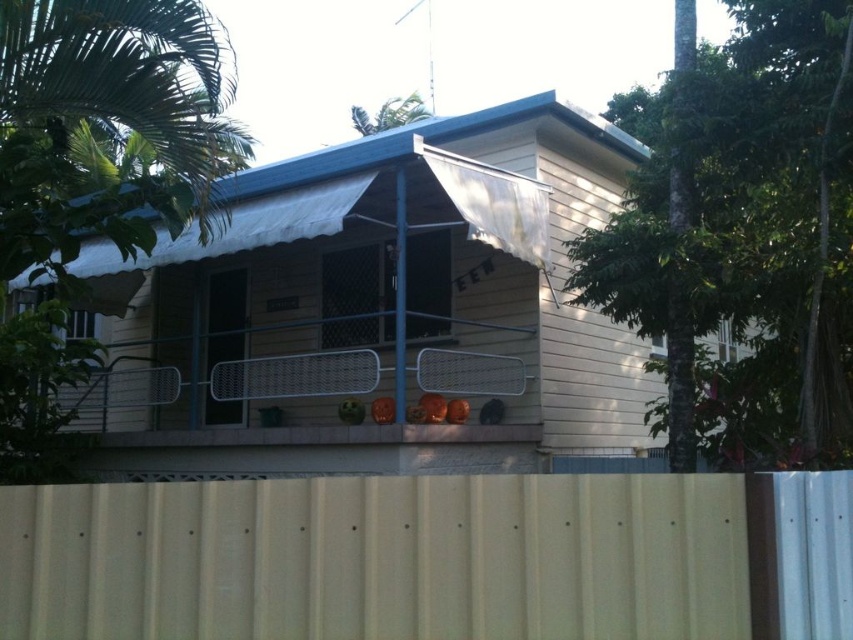
You are a drone operator trying to deliver a package to the house. You need to fly between two points marked as point (3, 506) and point (155, 385). Which point is closer to you so you can navigate safely?

Point (3, 506) is closer to the camera than point (155, 385), so you should navigate towards point (3, 506) first as it is nearer to your current position.

What is the exact coordinate of the tan corrugated metal at lower center in the image?

The tan corrugated metal at lower center is located at coordinate point [378,557].